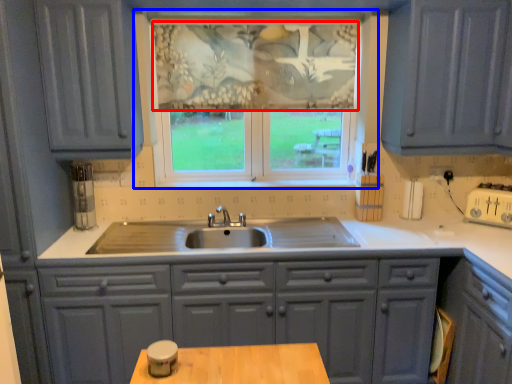
Question: Which of the following is the farthest to the observer, curtain (highlighted by a red box) or window (highlighted by a blue box)?

Choices:
 (A) curtain
 (B) window

Answer: (A)